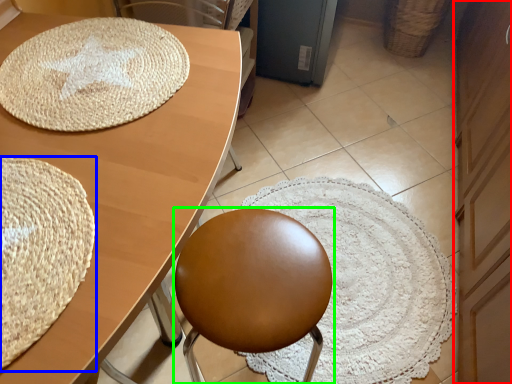
Question: Based on their relative distances, which object is nearer to dresser (highlighted by a red box)? Choose from mat (highlighted by a blue box) and chair (highlighted by a green box).

Choices:
 (A) mat
 (B) chair

Answer: (B)